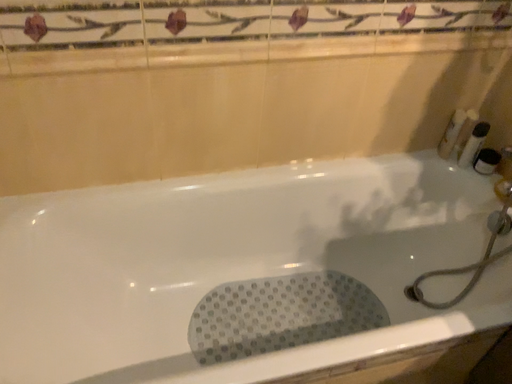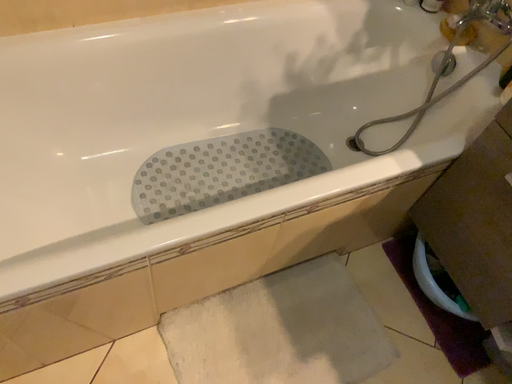
Question: Which way did the camera rotate in the video?

Choices:
 (A) rotated downward
 (B) rotated upward

Answer: (A)